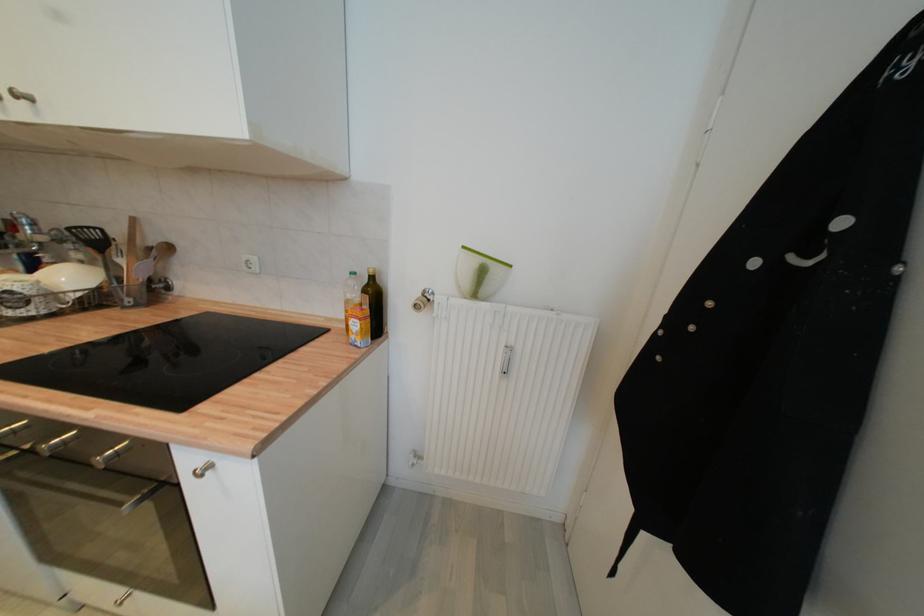
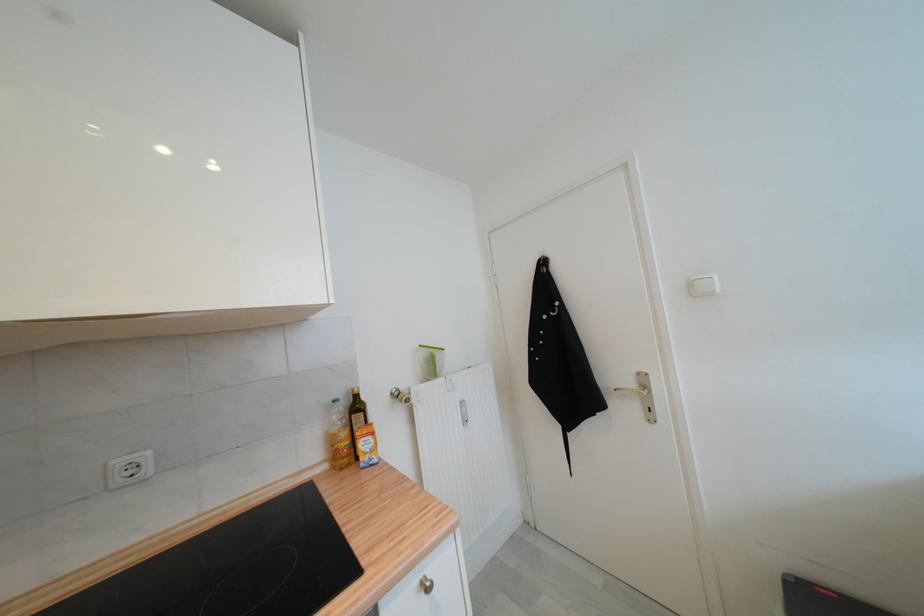
Locate, in the second image, the point that corresponds to point (250, 259) in the first image.

(126, 464)